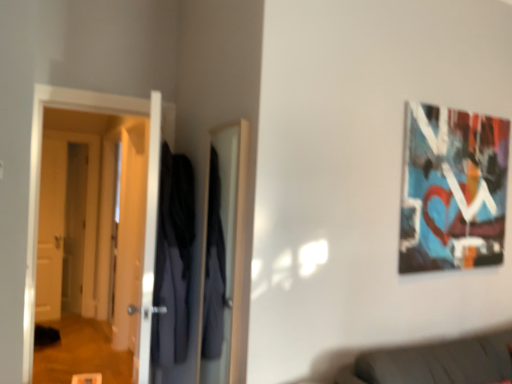
Question: Considering the relative sizes of white glossy door at left, the first door viewed from the front, and dark blue fabric robe at center in the image provided, is white glossy door at left, the first door viewed from the front, wider than dark blue fabric robe at center?

Choices:
 (A) yes
 (B) no

Answer: (B)

Question: From a real-world perspective, is white glossy door at left, acting as the 3th door starting from the back, positioned over dark blue fabric robe at center based on gravity?

Choices:
 (A) yes
 (B) no

Answer: (A)

Question: Is white glossy door at left, arranged as the 1th door when viewed from the right, next to dark blue fabric robe at center?

Choices:
 (A) no
 (B) yes

Answer: (A)

Question: Does white glossy door at left, marked as the 3th door in a left-to-right arrangement, contain dark blue fabric robe at center?

Choices:
 (A) no
 (B) yes

Answer: (A)

Question: Is white glossy door at left, the first door viewed from the front, not inside dark blue fabric robe at center?

Choices:
 (A) yes
 (B) no

Answer: (A)

Question: Is white glossy door at left, marked as the 3th door in a left-to-right arrangement, to the right of dark blue fabric robe at center from the viewer's perspective?

Choices:
 (A) yes
 (B) no

Answer: (B)

Question: Does wooden door at left, which is counted as the 2th door, starting from the back, have a lesser width compared to dark blue fabric robe at center?

Choices:
 (A) yes
 (B) no

Answer: (A)

Question: From the image's perspective, does wooden door at left, which is counted as the 2th door, starting from the back, appear lower than dark blue fabric robe at center?

Choices:
 (A) yes
 (B) no

Answer: (A)

Question: From a real-world perspective, is wooden door at left, acting as the 3th door starting from the right, beneath dark blue fabric robe at center?

Choices:
 (A) no
 (B) yes

Answer: (B)

Question: Considering the relative positions of wooden door at left, the 1th door in the left-to-right sequence, and dark blue fabric robe at center in the image provided, is wooden door at left, the 1th door in the left-to-right sequence, to the right of dark blue fabric robe at center from the viewer's perspective?

Choices:
 (A) yes
 (B) no

Answer: (B)

Question: Is wooden door at left, which is counted as the 2th door, starting from the back, smaller than dark blue fabric robe at center?

Choices:
 (A) no
 (B) yes

Answer: (B)

Question: Can you confirm if wooden door at left, which is counted as the 2th door, starting from the back, is wider than dark blue fabric robe at center?

Choices:
 (A) no
 (B) yes

Answer: (A)

Question: Is dark blue fabric robe at center looking in the opposite direction of white glossy door at left, marked as the 3th door in a left-to-right arrangement?

Choices:
 (A) no
 (B) yes

Answer: (A)